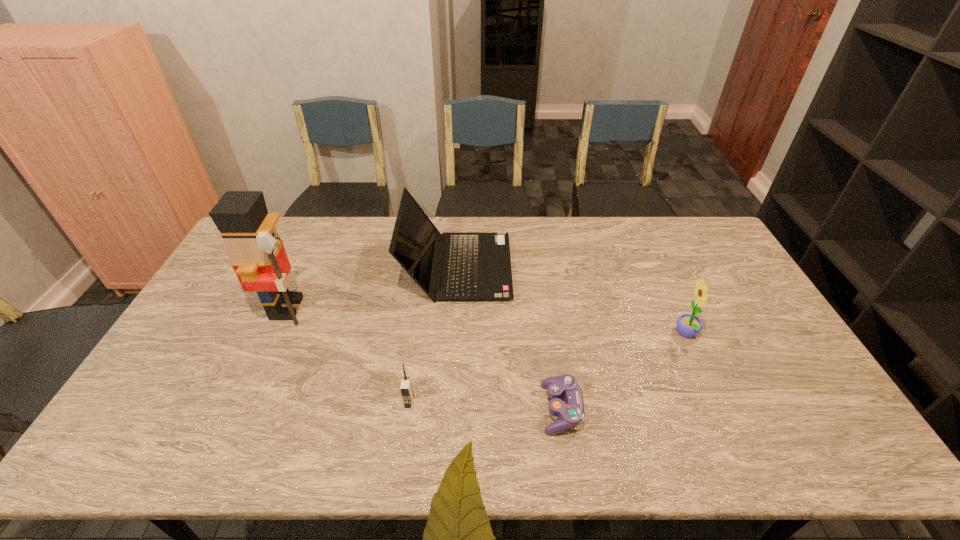
You are a GUI agent. You are given a task and a screenshot of the screen. Output one action in this format:
    pyautogui.click(x=<x>, y=<y>)
    Task: Click on the free space located on the front-facing side of the sunflower
    This screenshot has height=540, width=960.
    Given the screenshot: What is the action you would take?
    pyautogui.click(x=616, y=335)

Where is `free space located on the front-facing side of the sunflower`? free space located on the front-facing side of the sunflower is located at coordinates (596, 335).

This screenshot has height=540, width=960. Identify the location of vacant area located 0.110m on the front-facing side of the cellular telephone. (402, 453).

Find the location of a particular element. free space located on the back of the second object from right to left is located at coordinates (543, 296).

Locate an element on the screen. The image size is (960, 540). object that is at the far edge is located at coordinates (476, 266).

You are a GUI agent. You are given a task and a screenshot of the screen. Output one action in this format:
    pyautogui.click(x=<x>, y=<y>)
    Task: Click on the object situated at the near edge
    
    Given the screenshot: What is the action you would take?
    pyautogui.click(x=570, y=413)

Where is `free space at the far edge of the desktop`? Image resolution: width=960 pixels, height=540 pixels. free space at the far edge of the desktop is located at coordinates (634, 234).

The height and width of the screenshot is (540, 960). I want to click on free space at the near edge, so click(567, 432).

Where is `vacant space at the left edge of the desktop`? The width and height of the screenshot is (960, 540). vacant space at the left edge of the desktop is located at coordinates (241, 307).

This screenshot has width=960, height=540. I want to click on vacant area at the right edge of the desktop, so click(756, 370).